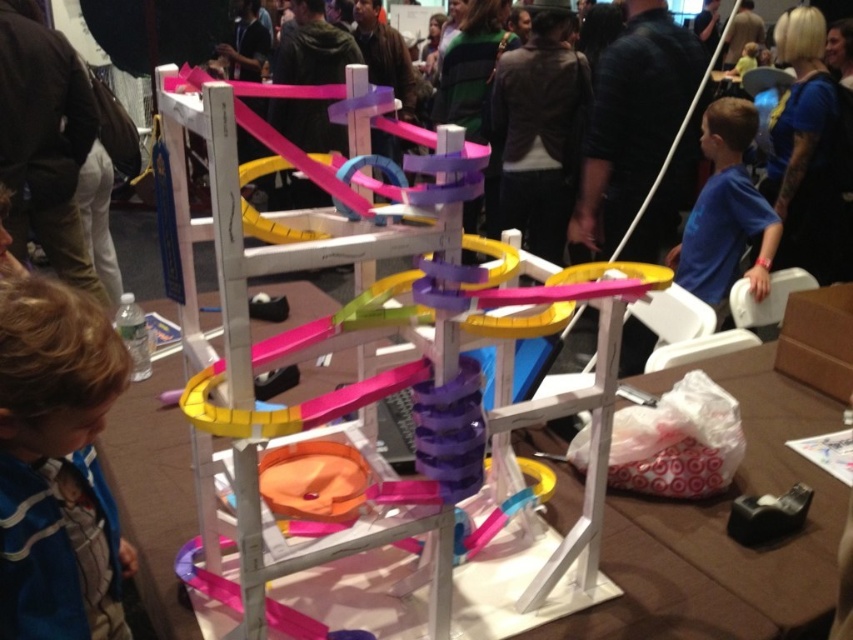
Question: Which point is farther to the camera?

Choices:
 (A) (724, 214)
 (B) (236, 372)

Answer: (A)

Question: Which of these objects is positioned farthest from the translucent plastic track at center?

Choices:
 (A) blue matte shirt at right
 (B) blue striped shirt at lower left

Answer: (A)

Question: Does translucent plastic track at center lie behind blue matte shirt at right?

Choices:
 (A) yes
 (B) no

Answer: (B)

Question: Can you confirm if translucent plastic track at center is thinner than blue striped shirt at lower left?

Choices:
 (A) yes
 (B) no

Answer: (B)

Question: Is translucent plastic track at center positioned at the back of blue matte shirt at right?

Choices:
 (A) no
 (B) yes

Answer: (A)

Question: Among these points, which one is nearest to the camera?

Choices:
 (A) (33, 282)
 (B) (323, 257)
 (C) (766, 212)

Answer: (B)